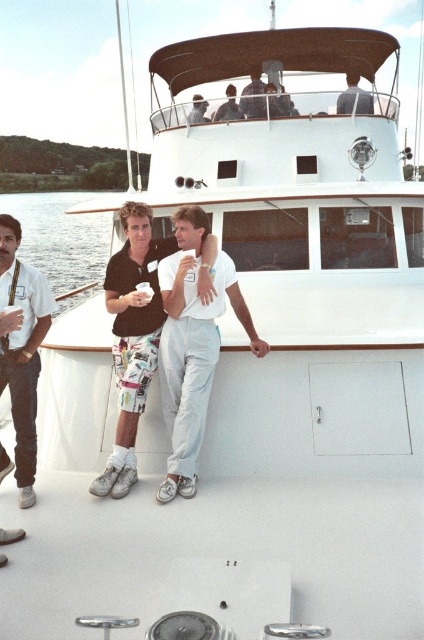
Between white smooth deck at lower center and gray fabric shirt at upper center, which one has less height?

With less height is white smooth deck at lower center.

Who is positioned more to the left, white smooth deck at lower center or gray fabric shirt at upper center?

From the viewer's perspective, white smooth deck at lower center appears more on the left side.

Does point (98, 548) come farther from viewer compared to point (354, 106)?

No, it is in front of (354, 106).

Find the location of a particular element. The height and width of the screenshot is (640, 424). white smooth deck at lower center is located at coordinates (219, 552).

Is white cotton shirt at left positioned in front of clear water at lower left?

That is True.

This screenshot has width=424, height=640. What are the coordinates of `white cotton shirt at left` in the screenshot? It's located at (22, 355).

Between white smooth deck at lower center and matte black shirt at upper center, which one appears on the right side from the viewer's perspective?

matte black shirt at upper center

Identify the location of white smooth deck at lower center. This screenshot has height=640, width=424. (219, 552).

At what (x,y) coordinates should I click in order to perform the action: click on white smooth deck at lower center. Please return your answer as a coordinate pair (x, y). Looking at the image, I should click on (219, 552).